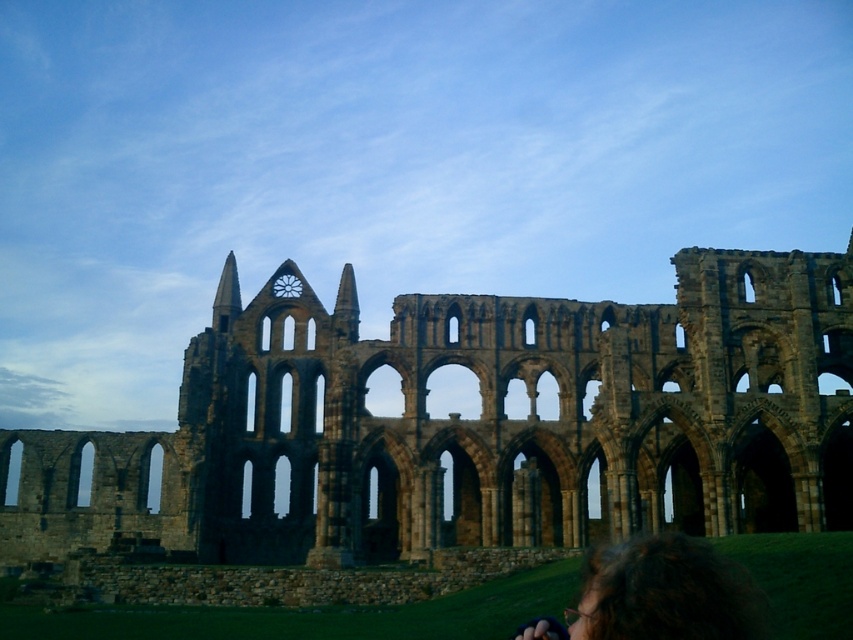
Does brown stone ruins at center have a lesser width compared to dark brown hair at lower right?

No, brown stone ruins at center is not thinner than dark brown hair at lower right.

Which is more to the left, brown stone ruins at center or dark brown hair at lower right?

brown stone ruins at center

Identify the location of brown stone ruins at center. The width and height of the screenshot is (853, 640). (469, 422).